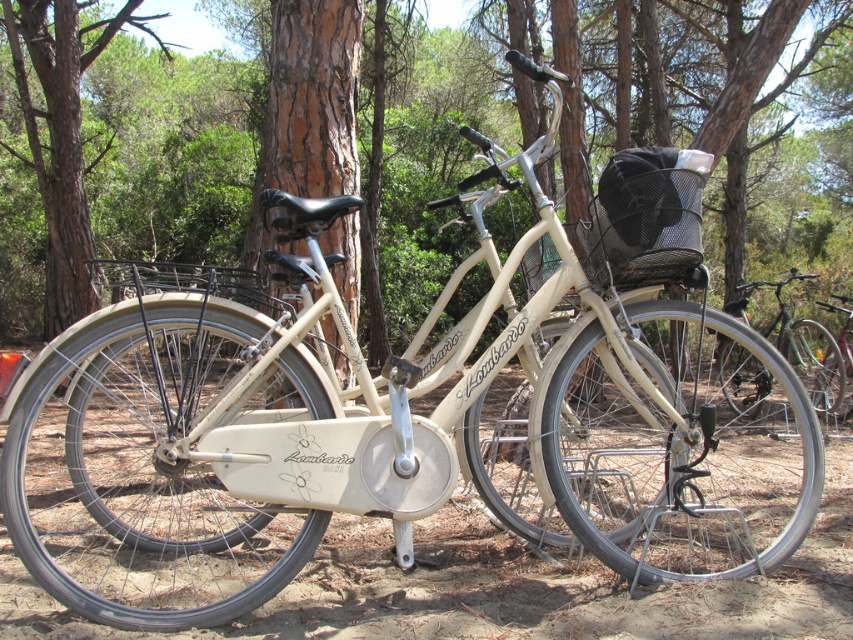
Does shiny silver bicycle at center have a lesser height compared to metallic silver bicycle at center?

Incorrect, shiny silver bicycle at center's height does not fall short of metallic silver bicycle at center's.

Between point (730, 305) and point (842, 353), which one is positioned behind?

Point (730, 305)

Measure the distance between point (820, 392) and camera.

Point (820, 392) and camera are 5.24 meters apart from each other.

This screenshot has height=640, width=853. In order to click on shiny silver bicycle at center in this screenshot , I will do `click(801, 346)`.